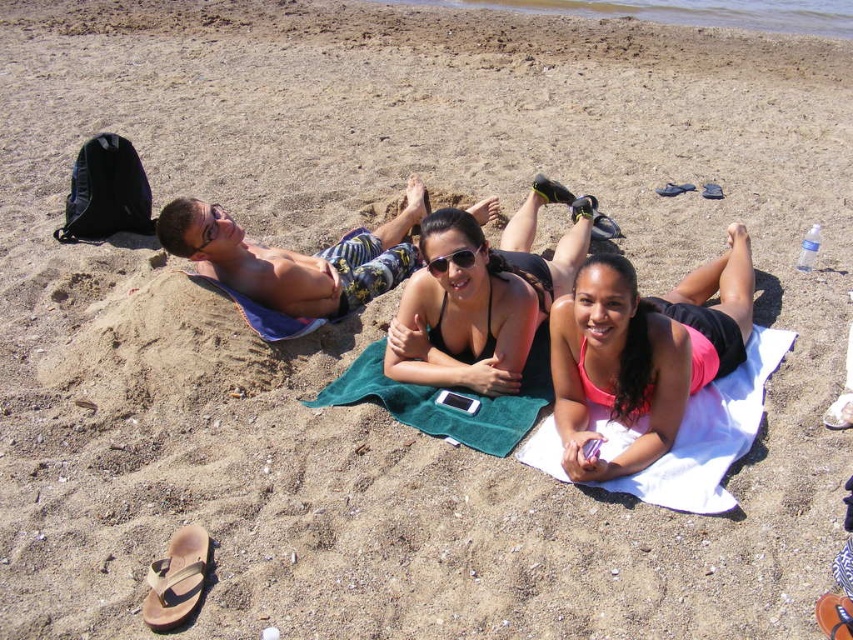
You are a photographer at the beach and want to take a picture of the sunglasses at center without including the white cotton towel at lower right in the frame. Is this possible based on their positions?

The white cotton towel at lower right is positioned under the sunglasses at center, so the sunglasses are above the towel. Since the towel is underneath, it won not be visible in the photo if the sunglasses are in focus and the camera angle avoids the lower area where the towel is located.